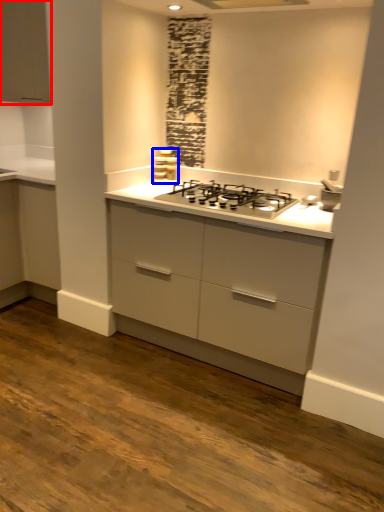
Question: Which object is closer to the camera taking this photo, cabinetry (highlighted by a red box) or appliance (highlighted by a blue box)?

Choices:
 (A) cabinetry
 (B) appliance

Answer: (A)